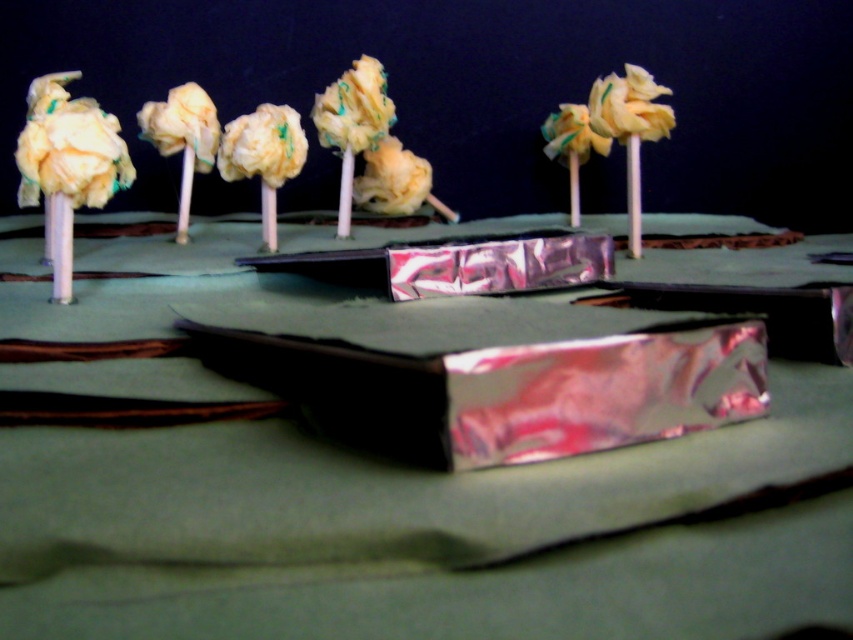
Question: Is yellow crumpled paper at upper right behind yellow fabric flower at upper center?

Choices:
 (A) no
 (B) yes

Answer: (A)

Question: Does yellow crumpled paper at upper right appear on the left side of matte yellow fabric flower at upper left?

Choices:
 (A) yes
 (B) no

Answer: (B)

Question: Which point is closer to the camera?

Choices:
 (A) white fluffy flower at center
 (B) yellow fabric flower at upper center
 (C) metallic silver table at center
 (D) fluffy yellow fabric at center

Answer: (C)

Question: Does metallic silver table at center lie in front of fluffy yellow fabric at center?

Choices:
 (A) yes
 (B) no

Answer: (A)

Question: Based on their relative distances, which object is nearer to the yellow fabric flower at upper center?

Choices:
 (A) matte yellow fabric flower at center
 (B) metallic silver table at center

Answer: (A)

Question: Among these points, which one is nearest to the camera?

Choices:
 (A) (68, 113)
 (B) (262, 115)

Answer: (A)